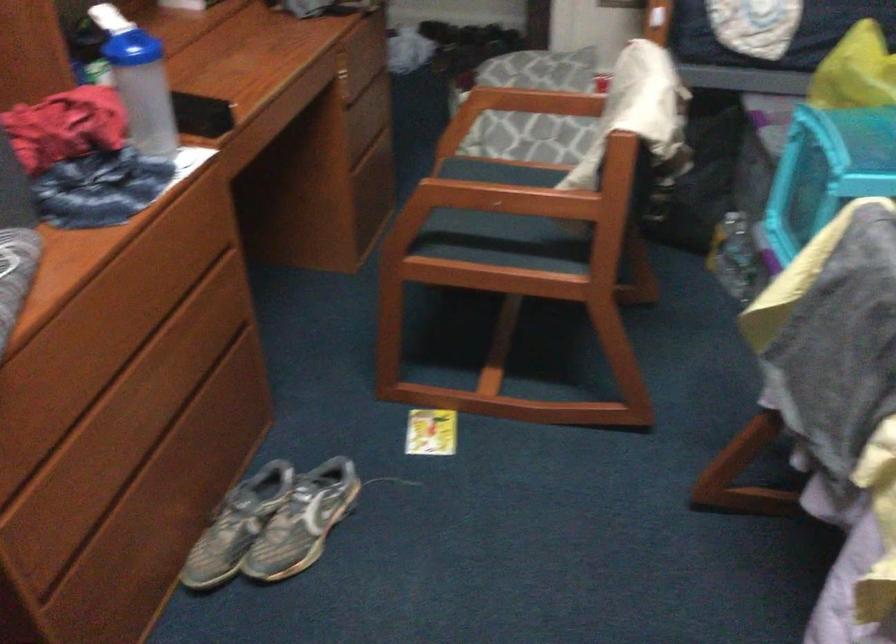
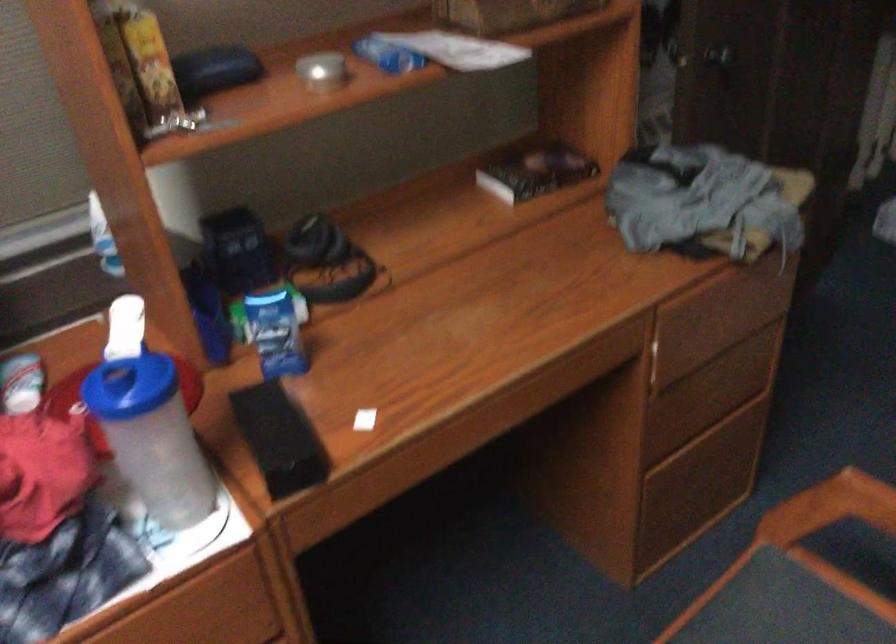
Where in the second image is the point corresponding to point (468, 175) from the first image?

(780, 614)